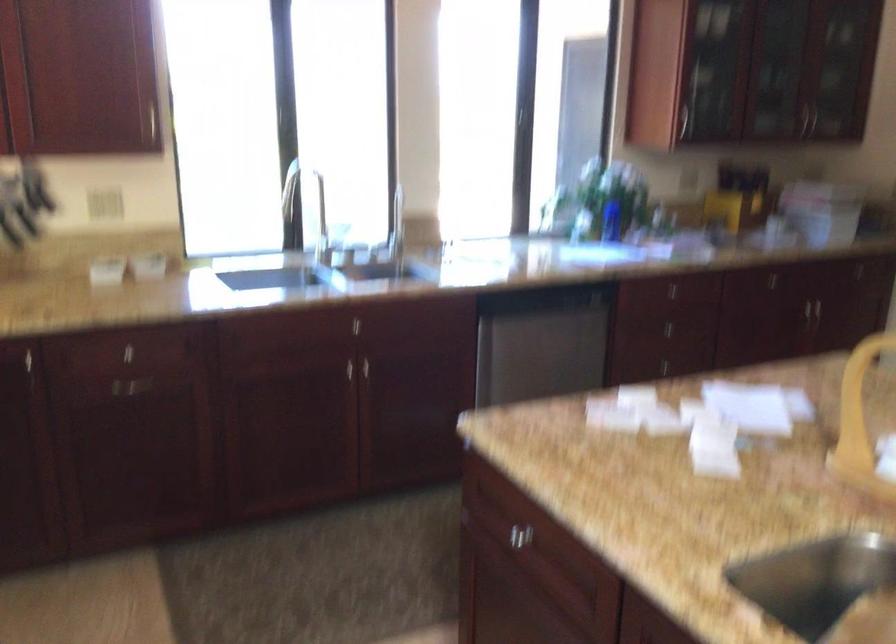
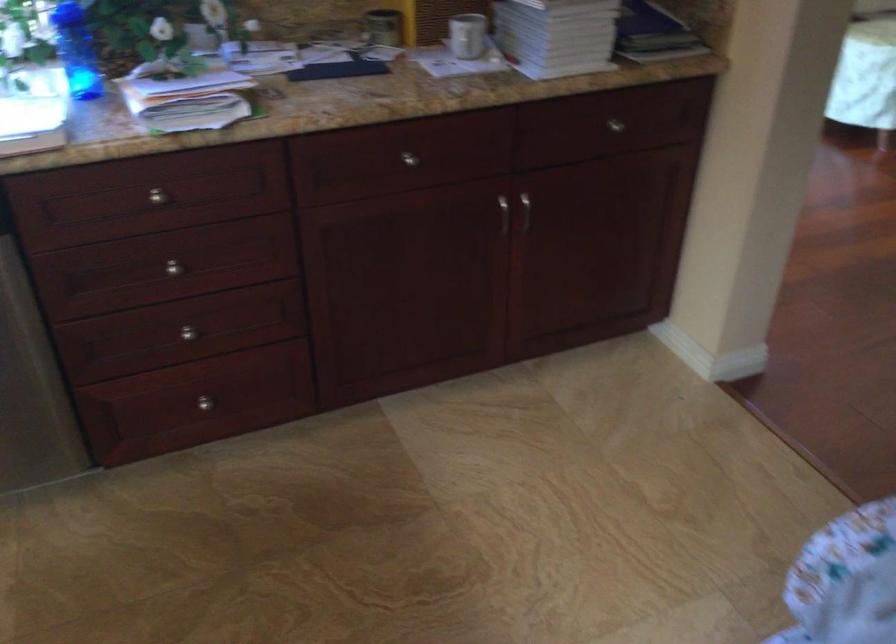
In the second image, find the point that corresponds to pixel 805 209 in the first image.

(467, 35)